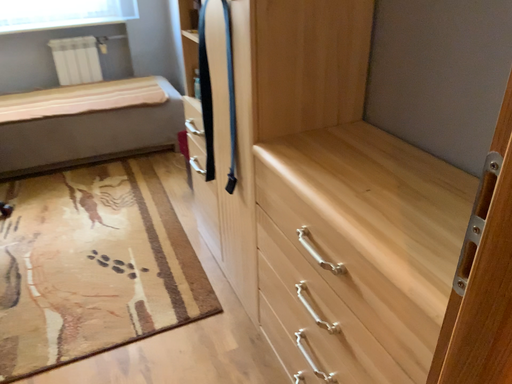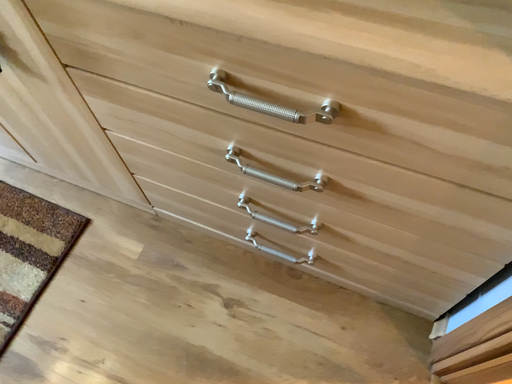
Question: Which way did the camera rotate in the video?

Choices:
 (A) rotated left
 (B) rotated right

Answer: (B)